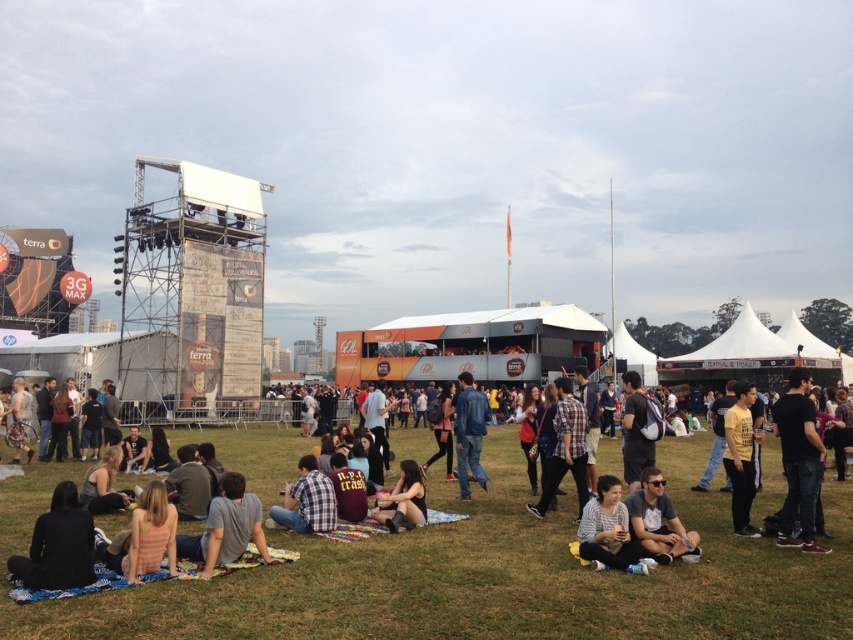
You are an attendee at the music festival and you want to sit on the picnic blanket where the black matte jacket at lower left and the matte gray sweater at lower center are located. Which item is covering the other one?

The black matte jacket at lower left is positioned over the matte gray sweater at lower center, so it is covering it.

You are standing at the center of the grassy field and want to find the black matte jacket at lower left. According to the coordinates given, in which direction should you move to locate it?

The black matte jacket at lower left is located at coordinates point (57, 545), so you should move towards the lower left direction from the center to find it.

You are a photographer at the event and want to capture a photo that includes both the black matte jacket at lower left and the yellow matte shirt at center. Which of the two clothing items should you focus on first to ensure both are in frame?

The black matte jacket at lower left is shorter than the yellow matte shirt at center, so you should focus on the yellow matte shirt at center first to ensure both are in frame.